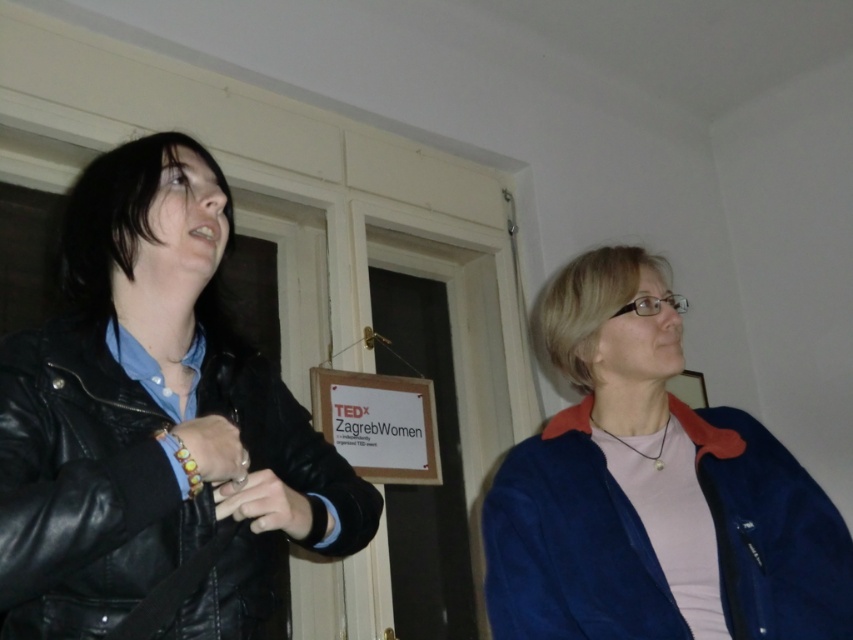
Question: Does black leather jacket at left have a greater width compared to leather bracelet at left?

Choices:
 (A) yes
 (B) no

Answer: (A)

Question: Which point is farther to the camera?

Choices:
 (A) black leather jacket at left
 (B) leather bracelet at left
 (C) blue suede jacket at right
 (D) matte black ring at lower left

Answer: (C)

Question: Does blue suede jacket at right appear on the right side of leather bracelet at left?

Choices:
 (A) yes
 (B) no

Answer: (A)

Question: Estimate the real-world distances between objects in this image. Which object is farther from the matte black ring at lower left?

Choices:
 (A) leather bracelet at left
 (B) blue suede jacket at right
 (C) black leather jacket at left

Answer: (B)

Question: Which is farther from the blue suede jacket at right?

Choices:
 (A) matte black ring at lower left
 (B) leather bracelet at left

Answer: (B)

Question: Is the position of blue suede jacket at right less distant than that of matte black ring at lower left?

Choices:
 (A) yes
 (B) no

Answer: (B)